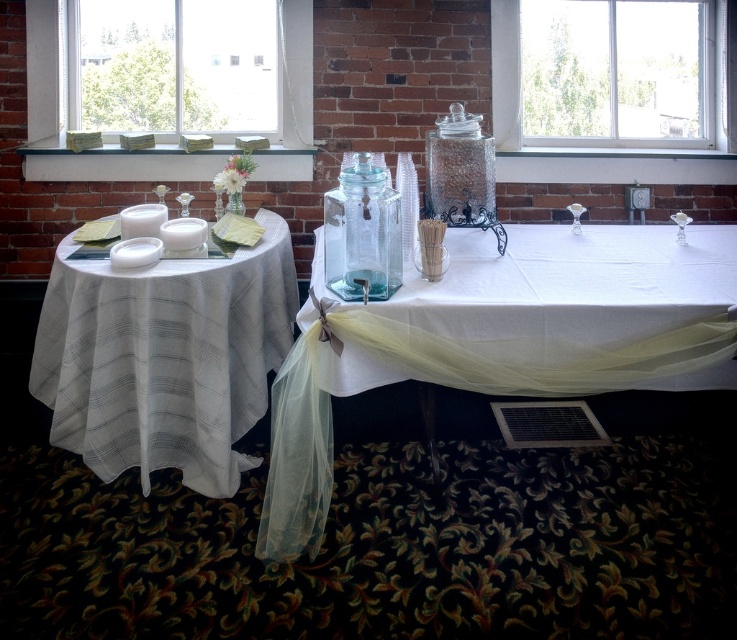
Question: Which object is farther from the camera taking this photo?

Choices:
 (A) white sheer tablecloth at left
 (B) transparent glass beverage dispenser at center

Answer: (A)

Question: Can you confirm if transparent glass beverage dispenser at center is thinner than clear glass jar at center?

Choices:
 (A) no
 (B) yes

Answer: (B)

Question: Based on their relative distances, which object is nearer to the green glass jars at upper left?

Choices:
 (A) clear glass window at upper right
 (B) white sheer tablecloth at left

Answer: (B)

Question: Is clear glass window at upper right below white matte candle at center?

Choices:
 (A) yes
 (B) no

Answer: (B)

Question: Which of the following is the farthest from the observer?

Choices:
 (A) white sheer tablecloth at left
 (B) translucent yellow fabric at lower center
 (C) transparent glass beverage dispenser at center

Answer: (A)

Question: Does white sheer tablecloth at left appear on the right side of white matte candle at center?

Choices:
 (A) no
 (B) yes

Answer: (B)